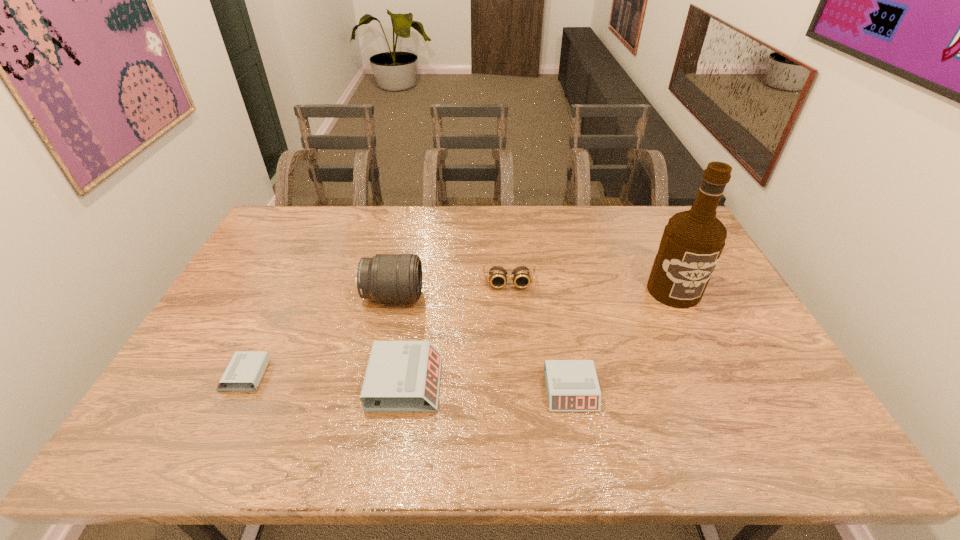
The image size is (960, 540). I want to click on vacant area situated 0.380m on the back of the tallest alarm clock, so click(423, 265).

Identify the location of free location located on the right of the fifth tallest object. (756, 390).

I want to click on free space located through the lenses of the goggles, so click(x=516, y=367).

This screenshot has width=960, height=540. Identify the location of free space located on the label of the tallest object. (732, 409).

Image resolution: width=960 pixels, height=540 pixels. I want to click on blank space located on the surface of the telephoto lens, so click(x=504, y=296).

Find the location of `object that is at the left edge`. object that is at the left edge is located at coordinates (244, 372).

Image resolution: width=960 pixels, height=540 pixels. Find the location of `object located at the right edge`. object located at the right edge is located at coordinates (692, 242).

Where is `object that is at the near left corner`? The image size is (960, 540). object that is at the near left corner is located at coordinates (244, 372).

At what (x,y) coordinates should I click in order to perform the action: click on vacant space at the far edge of the desktop. Please return your answer as a coordinate pair (x, y). Looking at the image, I should click on (584, 225).

Where is `blank space at the near edge of the desktop`? blank space at the near edge of the desktop is located at coordinates (660, 388).